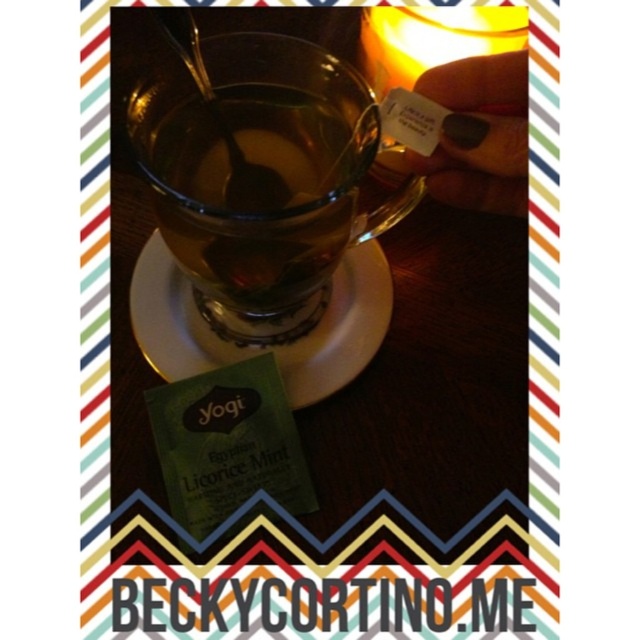
Please provide the 2D coordinates of the transparent glass teacup at center in the image.

The transparent glass teacup at center is located at the 2D coordinates of point (x=260, y=177).

You are a tea enthusiast who wants to place a 2.5 inch wide tea box between the transparent glass teacup at center and the green paper packet at lower left. Will there be enough space?

The transparent glass teacup at center and green paper packet at lower left are 1.93 inches apart, so placing a 2.5 inch wide tea box between them would not fit since the space is smaller than the box.

You are sitting at a table and want to reach for the transparent glass teacup at center and the green paper packet at lower left. Which object is closer to you?

The transparent glass teacup at center is closer to you because it is in front of the green paper packet at lower left.